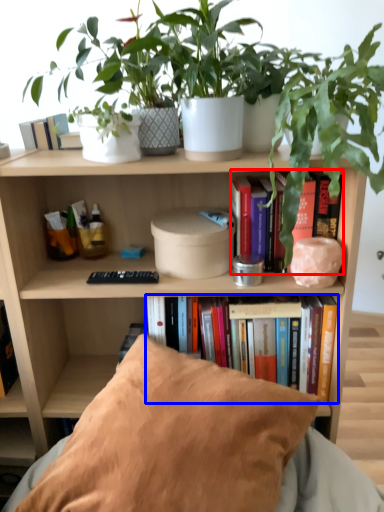
Question: Among these objects, which one is farthest to the camera, book (highlighted by a red box) or book (highlighted by a blue box)?

Choices:
 (A) book
 (B) book

Answer: (B)